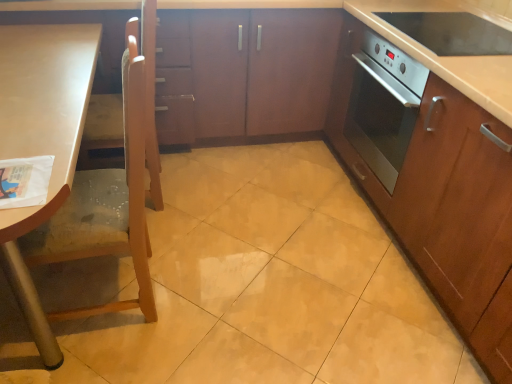
Question: From the image's perspective, is light brown wood chair at left located above satin wood countertop at right?

Choices:
 (A) yes
 (B) no

Answer: (B)

Question: From a real-world perspective, is light brown wood chair at left under satin wood countertop at right?

Choices:
 (A) no
 (B) yes

Answer: (B)

Question: Is light brown wood chair at left next to satin wood countertop at right?

Choices:
 (A) no
 (B) yes

Answer: (A)

Question: Is light brown wood chair at left to the right of satin wood countertop at right from the viewer's perspective?

Choices:
 (A) no
 (B) yes

Answer: (A)

Question: Is light brown wood chair at left shorter than satin wood countertop at right?

Choices:
 (A) no
 (B) yes

Answer: (A)

Question: From a real-world perspective, is light brown wood chair at left on satin wood countertop at right?

Choices:
 (A) yes
 (B) no

Answer: (B)

Question: From the image's perspective, is satin wood oven at right, the first cabinetry from the right, on satin wood countertop at right?

Choices:
 (A) yes
 (B) no

Answer: (B)

Question: Is satin wood oven at right, which is counted as the second cabinetry, starting from the left, far from satin wood countertop at right?

Choices:
 (A) yes
 (B) no

Answer: (B)

Question: Does satin wood oven at right, the first cabinetry from the right, appear on the left side of satin wood countertop at right?

Choices:
 (A) yes
 (B) no

Answer: (B)

Question: Considering the relative sizes of satin wood oven at right, which is counted as the second cabinetry, starting from the left, and satin wood countertop at right in the image provided, is satin wood oven at right, which is counted as the second cabinetry, starting from the left, bigger than satin wood countertop at right?

Choices:
 (A) yes
 (B) no

Answer: (A)

Question: Is satin wood oven at right, the first cabinetry from the right, wider than satin wood countertop at right?

Choices:
 (A) no
 (B) yes

Answer: (A)

Question: From a real-world perspective, is satin wood oven at right, the first cabinetry from the right, positioned over satin wood countertop at right based on gravity?

Choices:
 (A) no
 (B) yes

Answer: (A)

Question: Is the surface of metallic oven at right in direct contact with satin wood oven at right, the first cabinetry from the right?

Choices:
 (A) yes
 (B) no

Answer: (B)